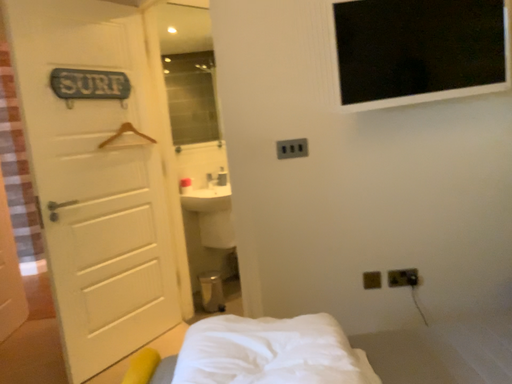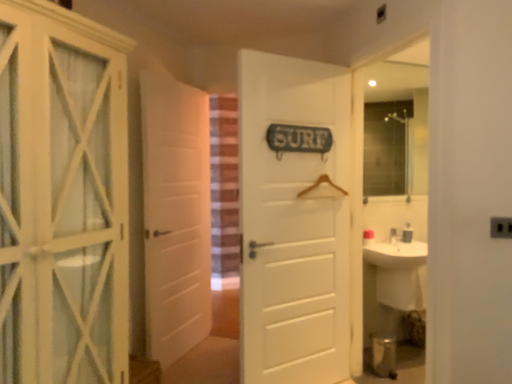
Question: Which way did the camera rotate in the video?

Choices:
 (A) rotated upward
 (B) rotated downward

Answer: (A)